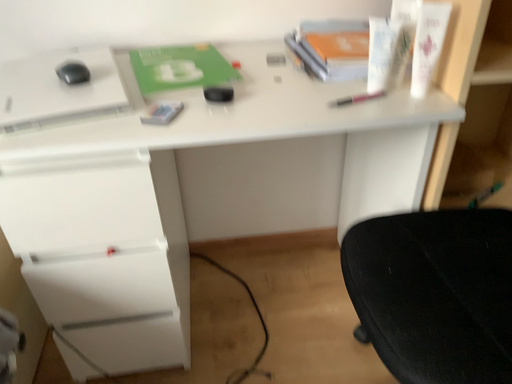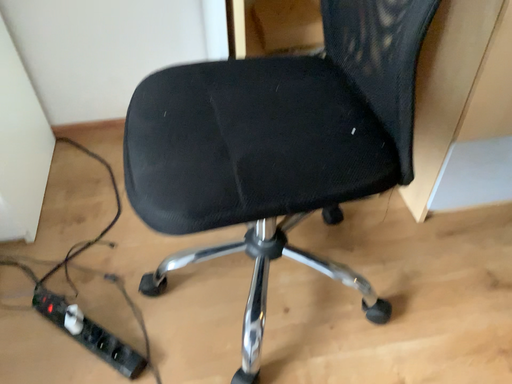
Question: How did the camera likely rotate when shooting the video?

Choices:
 (A) rotated downward
 (B) rotated upward

Answer: (A)